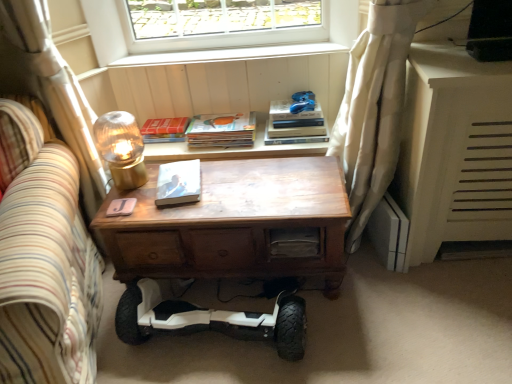
I want to click on empty space that is ontop of hardcover book at upper center, which ranks as the 3th paperback book in bottom-to-top order (from a real-world perspective), so click(161, 121).